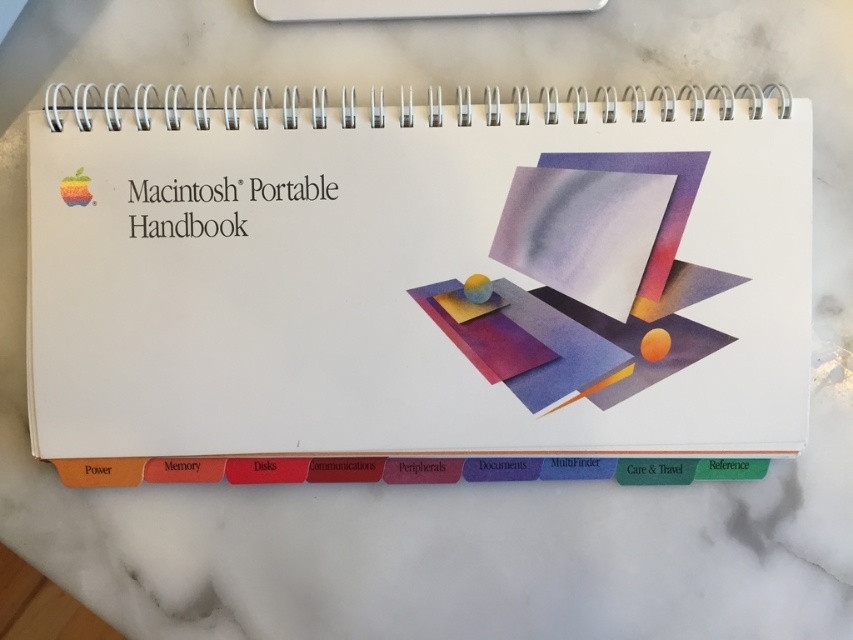
Question: Which object is closer to the camera taking this photo?

Choices:
 (A) white plastic ruler at upper center
 (B) white paper at center

Answer: (B)

Question: Among these objects, which one is nearest to the camera?

Choices:
 (A) white paper at center
 (B) white plastic ruler at upper center

Answer: (A)

Question: Is white paper at center to the left of white plastic ruler at upper center from the viewer's perspective?

Choices:
 (A) no
 (B) yes

Answer: (B)

Question: Does white paper at center have a smaller size compared to white plastic ruler at upper center?

Choices:
 (A) yes
 (B) no

Answer: (B)

Question: Considering the relative positions of white paper at center and white plastic ruler at upper center in the image provided, where is white paper at center located with respect to white plastic ruler at upper center?

Choices:
 (A) right
 (B) left

Answer: (B)